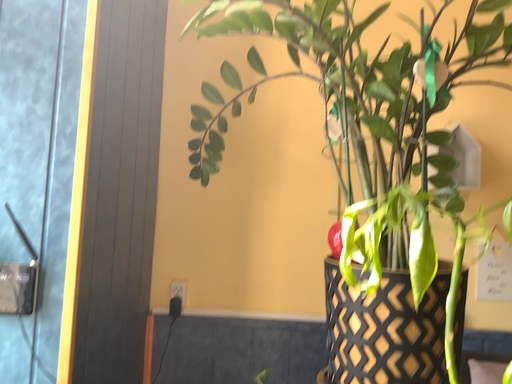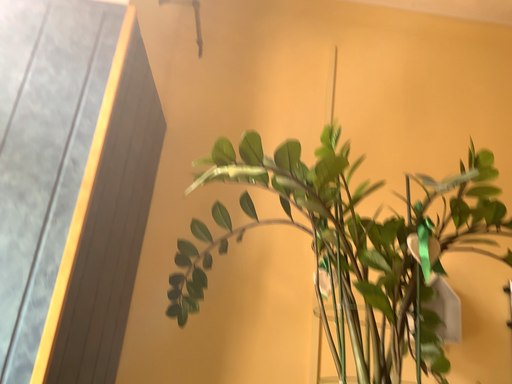
Question: How did the camera likely rotate when shooting the video?

Choices:
 (A) rotated upward
 (B) rotated downward

Answer: (A)